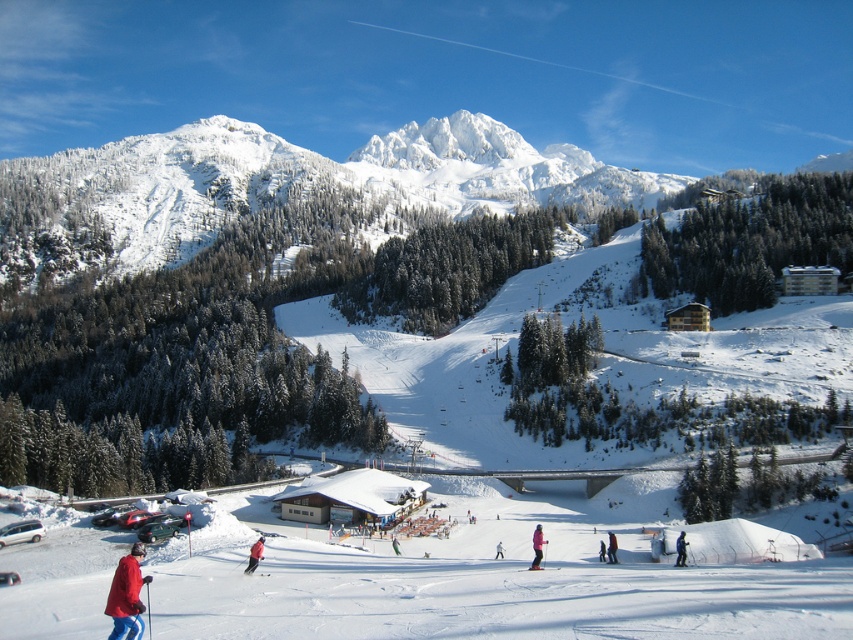
Question: Among these points, which one is nearest to the camera?

Choices:
 (A) (502, 556)
 (B) (132, 554)
 (C) (598, 554)
 (D) (537, 563)

Answer: (B)

Question: Which of the following is the farthest from the observer?

Choices:
 (A) (397, 545)
 (B) (611, 536)
 (C) (495, 554)

Answer: (A)

Question: Is pink fabric jacket at center to the left of blue ski suit at center from the viewer's perspective?

Choices:
 (A) yes
 (B) no

Answer: (A)

Question: Among these points, which one is nearest to the camera?

Choices:
 (A) (602, 556)
 (B) (393, 534)
 (C) (259, 548)

Answer: (C)

Question: From the image, what is the correct spatial relationship of matte red jacket at lower left in relation to green fabric jacket at center?

Choices:
 (A) right
 (B) left

Answer: (B)

Question: Does pink fabric jacket at center appear over red jacket at center?

Choices:
 (A) no
 (B) yes

Answer: (B)